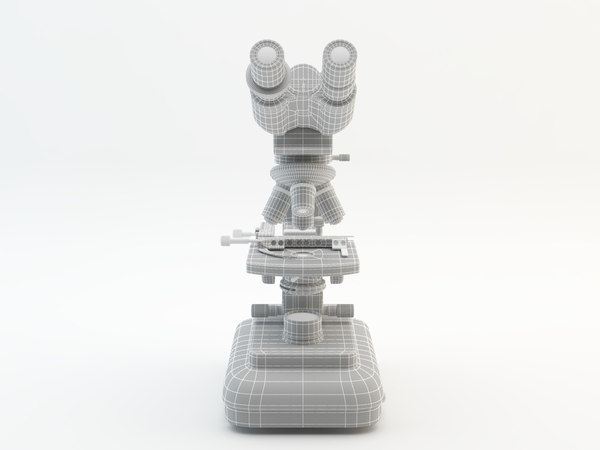
Where is `area to left of microscope`? area to left of microscope is located at coordinates pos(173,256).